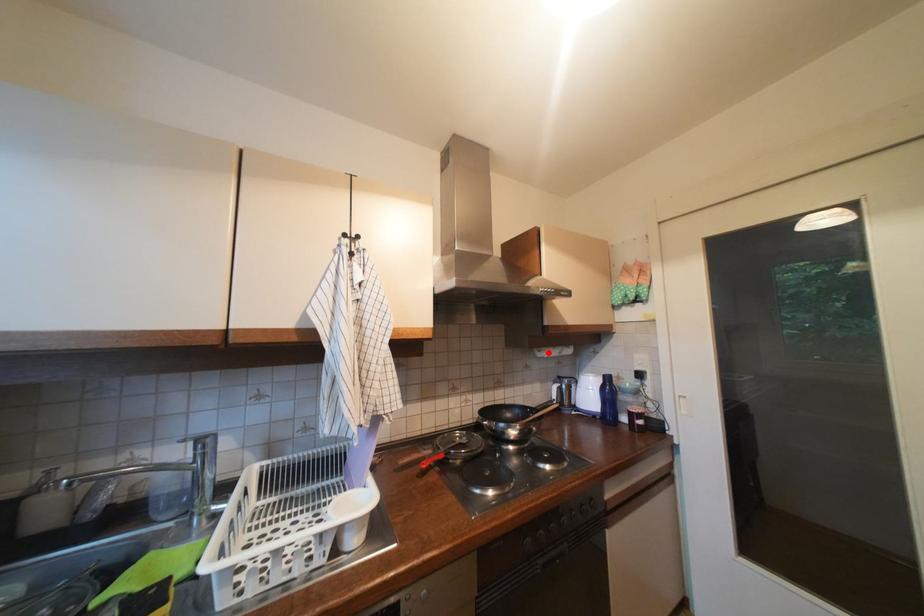
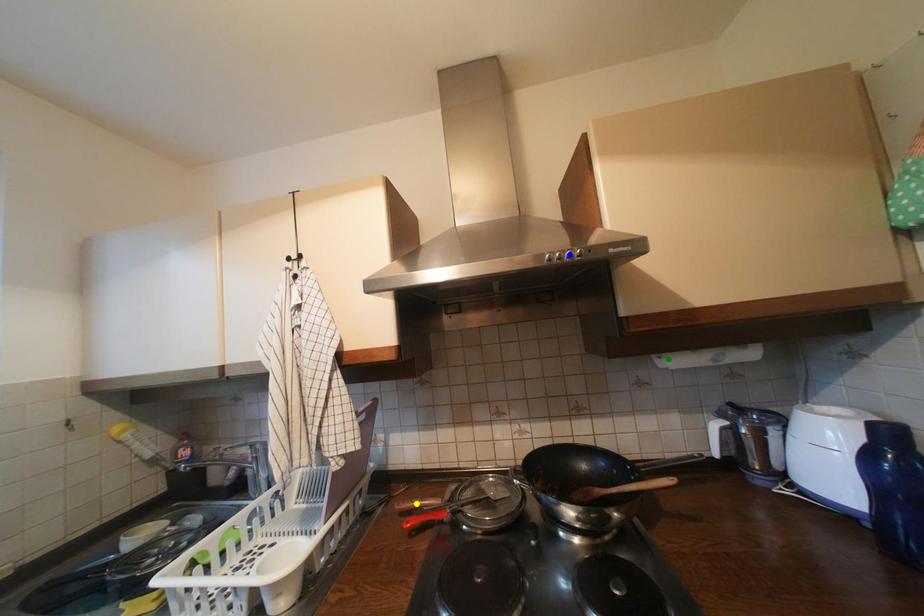
Question: I am providing you with two images of the same scene from different viewpoints. A red point is marked on the first image. You are given multiple points on the second image. Which point in image 2 represents the same 3d spot as the red point in image 1?

Choices:
 (A) green point
 (B) blue point
 (C) yellow point

Answer: (A)